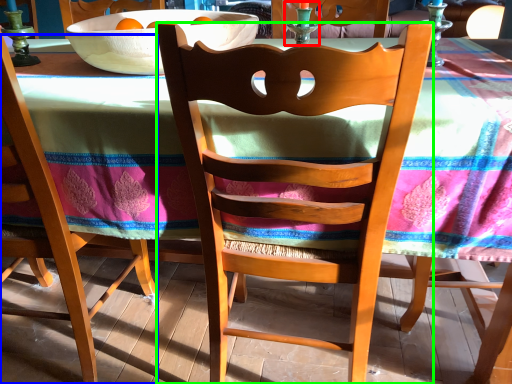
Question: Estimate the real-world distances between objects in this image. Which object is closer to candle holder (highlighted by a red box), chair (highlighted by a blue box) or chair (highlighted by a green box)?

Choices:
 (A) chair
 (B) chair

Answer: (B)